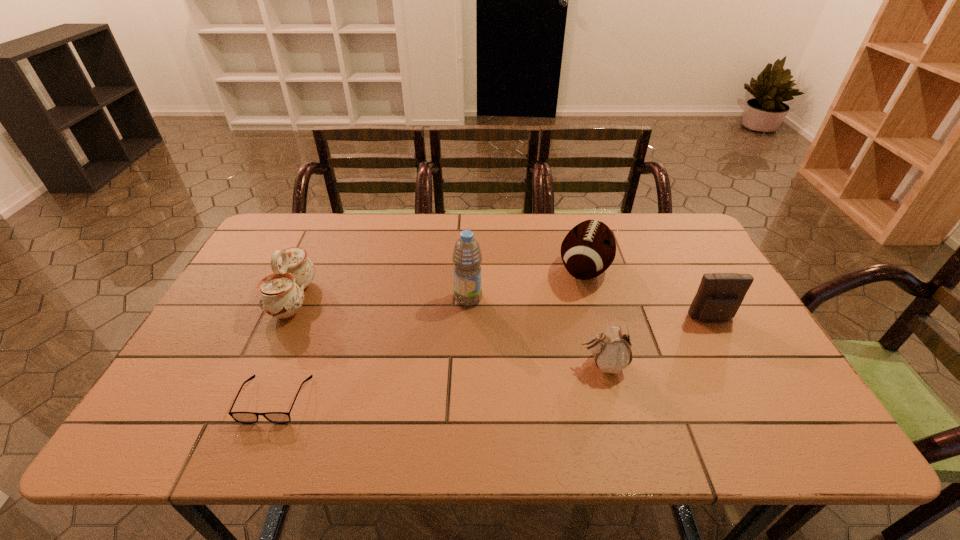
I want to click on free space between the chinaware and the third object from left to right, so click(x=381, y=299).

Identify the location of vacant space that's between the shortest object and the rightmost object. Image resolution: width=960 pixels, height=540 pixels. (493, 359).

Locate an element on the screen. This screenshot has width=960, height=540. free area in between the spectacles and the nearer pouch is located at coordinates (439, 382).

This screenshot has height=540, width=960. What are the coordinates of `blank region between the water bottle and the football (American)` in the screenshot? It's located at point(526,284).

At what (x,y) coordinates should I click in order to perform the action: click on object that can be found as the second closest to the left pouch. Please return your answer as a coordinate pair (x, y). Looking at the image, I should click on (719, 296).

Identify the location of object that is the fourth nearest to the football (American). (241, 417).

Image resolution: width=960 pixels, height=540 pixels. What are the coordinates of `blank space that satisfies the following two spatial constraints: 1. on the front-facing side of the nearer pouch; 2. on the front-facing side of the spectacles` in the screenshot? It's located at (612, 400).

Locate an element on the screen. The image size is (960, 540). vacant space that satisfies the following two spatial constraints: 1. with an open flap on the rightmost object; 2. on the front-facing side of the left pouch is located at coordinates (736, 364).

I want to click on vacant position in the image that satisfies the following two spatial constraints: 1. on the front-facing side of the nearer pouch; 2. on the front-facing side of the shortest object, so click(612, 400).

What are the coordinates of `free space that satisfies the following two spatial constraints: 1. with an open flap on the farther pouch; 2. on the front-facing side of the left pouch` in the screenshot? It's located at (736, 364).